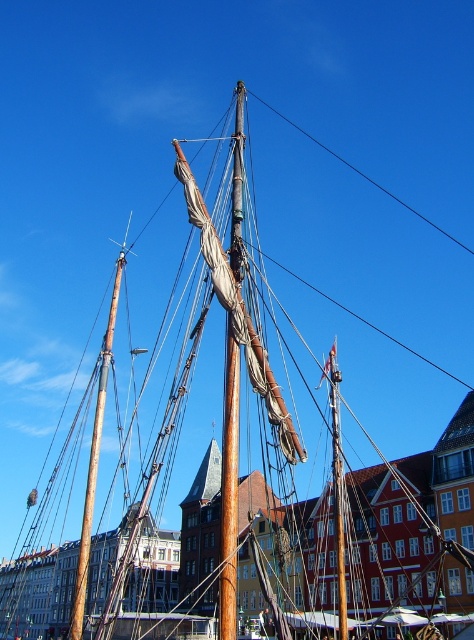
Between wooden mast at center and brown wood mast at upper center, which one appears on the right side from the viewer's perspective?

wooden mast at center

Who is more forward, (231, 605) or (107, 333)?

Point (231, 605) is more forward.

You are a GUI agent. You are given a task and a screenshot of the screen. Output one action in this format:
    pyautogui.click(x=<x>, y=<y>)
    Task: Click on the wooden mast at center
    The image size is (474, 640).
    Given the screenshot: What is the action you would take?
    (229, 486)